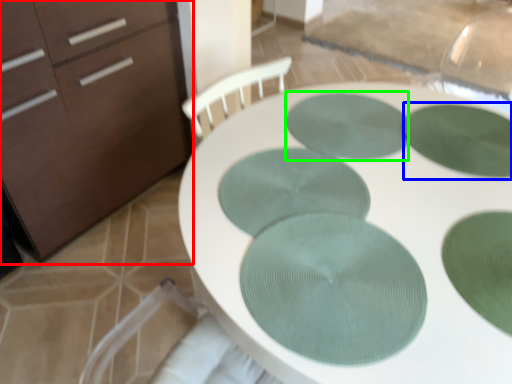
Question: Which object is the closest to the chest of drawers (highlighted by a red box)? Choose among these: glass plate (highlighted by a blue box) or glass plate (highlighted by a green box).

Choices:
 (A) glass plate
 (B) glass plate

Answer: (B)